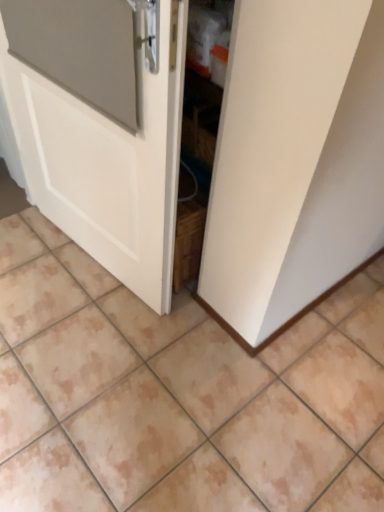
Describe the element at coordinates (177, 394) in the screenshot. This screenshot has height=512, width=384. I see `beige ceramic tile at center` at that location.

I want to click on beige ceramic tile at center, so pyautogui.click(x=177, y=394).

What is the approximate width of beige ceramic tile at center?

It is 6.10 feet.

Measure the distance between point (315, 439) and camera.

Point (315, 439) is 1.42 meters away from camera.

What do you see at coordinates (101, 126) in the screenshot?
I see `white matte door at center` at bounding box center [101, 126].

Locate an element on the screen. The height and width of the screenshot is (512, 384). white matte door at center is located at coordinates (101, 126).

Locate an element on the screen. This screenshot has height=512, width=384. beige ceramic tile at center is located at coordinates (177, 394).

In the image, is beige ceramic tile at center on the left side or the right side of white matte door at center?

beige ceramic tile at center is positioned on white matte door at center's right side.

Is the position of beige ceramic tile at center more distant than that of white matte door at center?

Yes, it is.

Is point (110, 279) closer to viewer compared to point (161, 85)?

That is False.

From the image's perspective, which one is positioned lower, beige ceramic tile at center or white matte door at center?

beige ceramic tile at center appears lower in the image.

From a real-world perspective, relative to white matte door at center, is beige ceramic tile at center vertically above or below?

In terms of real-world spatial position, beige ceramic tile at center is below white matte door at center.

Is beige ceramic tile at center wider than white matte door at center?

Yes.

Between beige ceramic tile at center and white matte door at center, which one has more height?

white matte door at center is taller.

Considering the sizes of beige ceramic tile at center and white matte door at center in the image, is beige ceramic tile at center bigger or smaller than white matte door at center?

Considering their sizes, beige ceramic tile at center takes up more space than white matte door at center.

Would you say beige ceramic tile at center is outside white matte door at center?

beige ceramic tile at center is positioned outside white matte door at center.

Are beige ceramic tile at center and white matte door at center located far from each other?

That's not correct — beige ceramic tile at center is a little close to white matte door at center.

Is beige ceramic tile at center facing towards white matte door at center?

No, beige ceramic tile at center is not aimed at white matte door at center.

Based on the photo, can you tell me how much beige ceramic tile at center and white matte door at center differ in facing direction?

They differ by 173 degrees in their facing directions.

The image size is (384, 512). I want to click on ceramic tile beneath the white matte door at center (from a real-world perspective), so click(177, 394).

Considering the positions of objects white matte door at center and beige ceramic tile at center in the image provided, who is more to the left, white matte door at center or beige ceramic tile at center?

Positioned to the left is white matte door at center.

Relative to beige ceramic tile at center, is white matte door at center in front or behind?

Visually, white matte door at center is located in front of beige ceramic tile at center.

Is point (127, 85) positioned behind point (304, 404)?

No, it is in front of (304, 404).

From the image's perspective, is white matte door at center over beige ceramic tile at center?

Yes.

From a real-world perspective, is white matte door at center on beige ceramic tile at center?

Indeed, from a real-world perspective, white matte door at center stands above beige ceramic tile at center.

Is white matte door at center wider or thinner than beige ceramic tile at center?

Considering their sizes, white matte door at center looks slimmer than beige ceramic tile at center.

Is white matte door at center taller or shorter than beige ceramic tile at center?

white matte door at center is taller than beige ceramic tile at center.

Considering the sizes of objects white matte door at center and beige ceramic tile at center in the image provided, who is bigger, white matte door at center or beige ceramic tile at center?

Bigger between the two is beige ceramic tile at center.

Choose the correct answer: Is white matte door at center inside beige ceramic tile at center or outside it?

white matte door at center is not enclosed by beige ceramic tile at center.

Would you say white matte door at center is a long distance from beige ceramic tile at center?

No, white matte door at center is in close proximity to beige ceramic tile at center.

Is beige ceramic tile at center at the back of white matte door at center?

Yes.

How many degrees apart are the facing directions of white matte door at center and beige ceramic tile at center?

They differ by 173 degrees in their facing directions.

You are a GUI agent. You are given a task and a screenshot of the screen. Output one action in this format:
    pyautogui.click(x=<x>, y=<y>)
    Task: Click on the door located on the left of beige ceramic tile at center
    
    Given the screenshot: What is the action you would take?
    coord(101,126)

You are a GUI agent. You are given a task and a screenshot of the screen. Output one action in this format:
    pyautogui.click(x=<x>, y=<y>)
    Task: Click on the ceramic tile below the white matte door at center (from a real-world perspective)
    
    Given the screenshot: What is the action you would take?
    pyautogui.click(x=177, y=394)

Where is `door on the left of beige ceramic tile at center`? This screenshot has width=384, height=512. door on the left of beige ceramic tile at center is located at coordinates (101, 126).